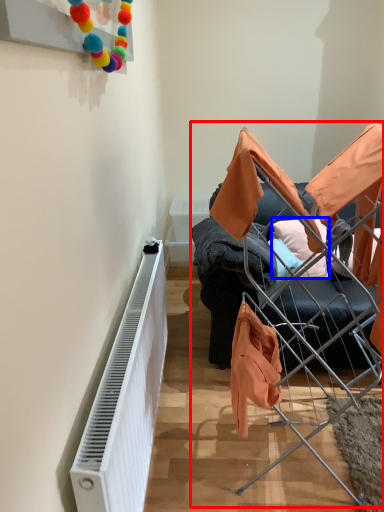
Question: Which object appears closest to the camera in this image, bunk bed (highlighted by a red box) or pillow (highlighted by a blue box)?

Choices:
 (A) bunk bed
 (B) pillow

Answer: (A)